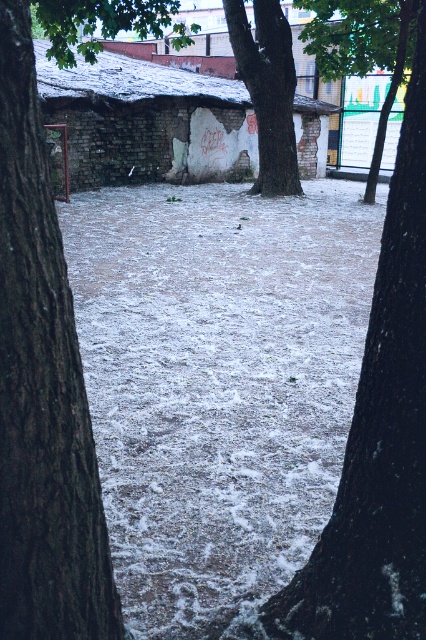
Which is above, smooth brown tree trunk at center or green leafy tree at upper center?

green leafy tree at upper center is above.

Who is positioned more to the left, smooth brown tree trunk at center or green leafy tree at upper center?

From the viewer's perspective, smooth brown tree trunk at center appears more on the left side.

Measure the distance between point (281, 17) and camera.

Point (281, 17) and camera are 20.04 meters apart from each other.

Identify the location of smooth brown tree trunk at center. (267, 90).

Is brown rough bark at left taller than green leafy tree at upper center?

Yes.

Does point (19, 189) come in front of point (396, 36)?

Yes, it is.

Locate an element on the screen. This screenshot has width=426, height=640. brown rough bark at left is located at coordinates (43, 390).

Is brown rough bark at left shorter than smooth brown tree trunk at center?

Indeed, brown rough bark at left has a lesser height compared to smooth brown tree trunk at center.

Can you confirm if brown rough bark at left is thinner than smooth brown tree trunk at center?

Yes.

Where is `brown rough bark at left`? brown rough bark at left is located at coordinates (43, 390).

The height and width of the screenshot is (640, 426). Find the location of `brown rough bark at left`. brown rough bark at left is located at coordinates (43, 390).